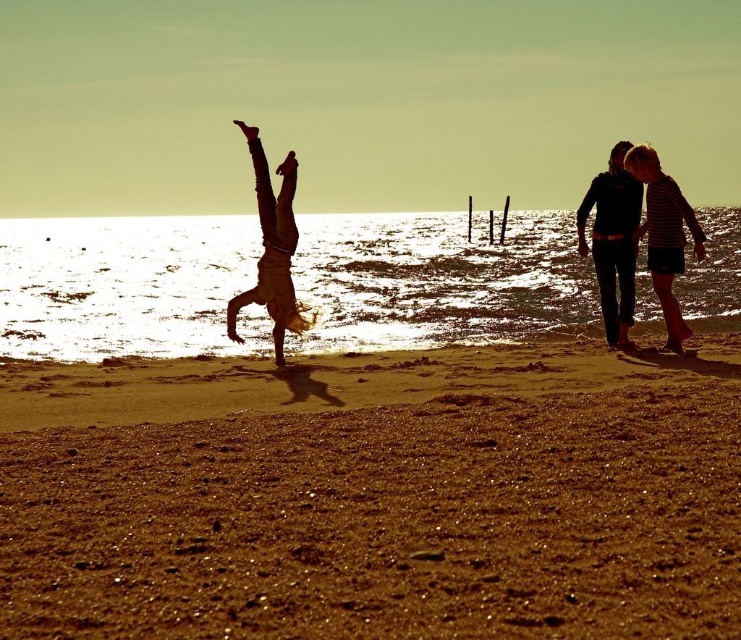
You are a photographer trying to capture the silhouette figure at center and the silhouette clothing at right in a single shot. Based on their positions, can you determine which one will appear closer to the camera in the photo?

The silhouette clothing at right is in front of the silhouette figure at center, so it will appear closer to the camera in the photo.